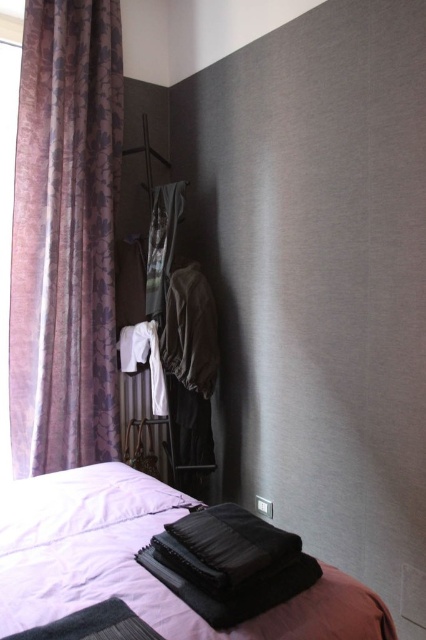
Is white soft pillow at lower left in front of black matte pillow at lower center?

No.

Can you confirm if white soft pillow at lower left is bigger than black matte pillow at lower center?

Yes, white soft pillow at lower left is bigger than black matte pillow at lower center.

Which is in front, point (100, 499) or point (250, 515)?

Positioned in front is point (250, 515).

The image size is (426, 640). Identify the location of white soft pillow at lower left. (77, 502).

Does point (331, 604) come behind point (235, 506)?

No.

Where is `matte black suitcase at lower center`? The image size is (426, 640). matte black suitcase at lower center is located at coordinates [x=138, y=563].

Can you confirm if brown textured curtain at left is positioned to the left of white soft pillow at lower left?

Indeed, brown textured curtain at left is positioned on the left side of white soft pillow at lower left.

Is brown textured curtain at left in front of white soft pillow at lower left?

No.

Is point (31, 294) positioned after point (155, 509)?

Yes, it is.

I want to click on brown textured curtain at left, so click(66, 236).